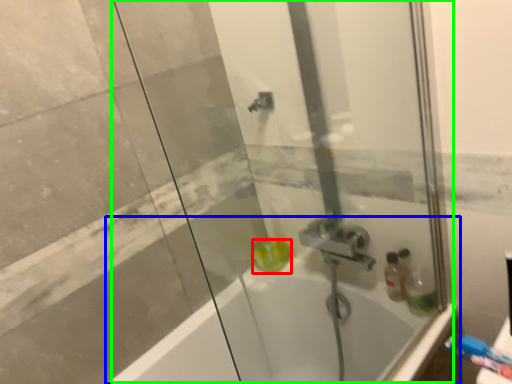
Question: Based on their relative distances, which object is nearer to liquid (highlighted by a red box)? Choose from bathtub (highlighted by a blue box) and shower door (highlighted by a green box).

Choices:
 (A) bathtub
 (B) shower door

Answer: (A)